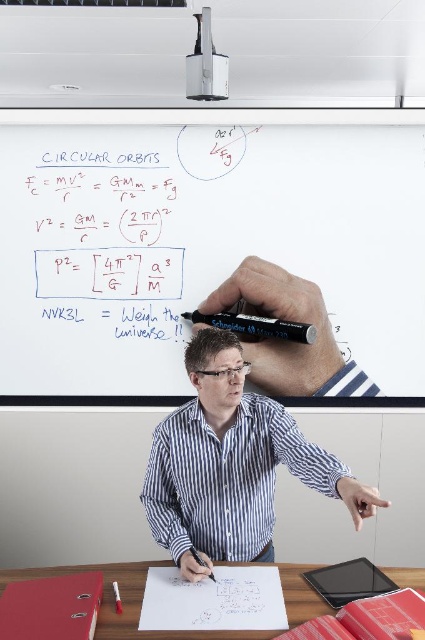
You are a student in the classroom and need to place both the wooden table at lower center and the black marker pen at center on a shelf. The shelf can only hold items that are narrower than 1 meter. Can you fit both items on the shelf?

The wooden table at lower center is wider than the black marker pen at center. Since the shelf requires items narrower than 1 meter, we need to check each object individually. However, the description only provides a comparison between their widths but does not specify exact measurements. Without knowing the exact width of either item, it is impossible to determine if both will fit on the shelf.

From the picture: You are a student carrying a 1.5 meter long poster that you need to place between the whiteboard at upper center and the wooden table at lower center. Can you fit the poster horizontally between them without bending it?

The distance between the whiteboard at upper center and the wooden table at lower center is 1.63 meters. Since the poster is 1.5 meters long, it can fit horizontally between them without bending.

You are a student sitting at the wooden table at lower center in the classroom. You want to look at the whiteboard at upper center. Which direction should you look to see it?

The whiteboard at upper center is located above the wooden table at lower center, so you should look upward to see it.